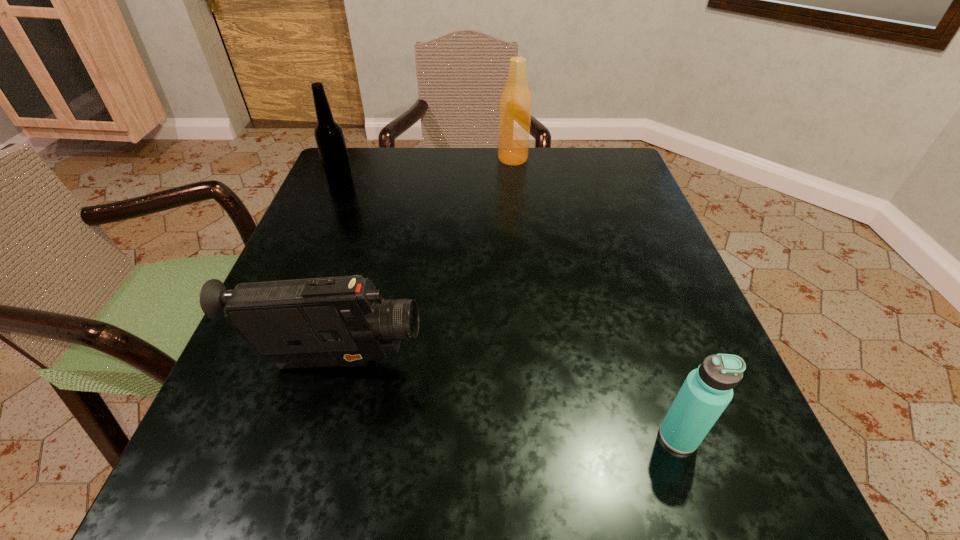
Locate an element on the screen. This screenshot has width=960, height=540. vacant space at the right edge is located at coordinates (692, 360).

Identify the location of free space at the far left corner of the desktop. The image size is (960, 540). (366, 176).

At what (x,y) coordinates should I click in order to perform the action: click on vacant space at the far right corner of the desktop. Please return your answer as a coordinate pair (x, y). The image size is (960, 540). Looking at the image, I should click on (567, 187).

The height and width of the screenshot is (540, 960). I want to click on vacant area at the near right corner of the desktop, so click(657, 491).

This screenshot has width=960, height=540. Find the location of `vacant space in between the camcorder and the right beer bottle`. vacant space in between the camcorder and the right beer bottle is located at coordinates (423, 261).

This screenshot has height=540, width=960. In order to click on vacant space that's between the camcorder and the third nearest object in this screenshot , I will do `click(338, 273)`.

The image size is (960, 540). I want to click on empty space that is in between the rightmost object and the nearer beer bottle, so click(x=510, y=310).

Locate an element on the screen. The height and width of the screenshot is (540, 960). vacant space that's between the thermos bottle and the second object from right to left is located at coordinates (595, 298).

You are a GUI agent. You are given a task and a screenshot of the screen. Output one action in this format:
    pyautogui.click(x=<x>, y=<y>)
    Task: Click on the empty space that is in between the nearer beer bottle and the second object from right to left
    
    Given the screenshot: What is the action you would take?
    pyautogui.click(x=427, y=171)

Identify the location of free space between the right beer bottle and the camcorder. (423, 261).